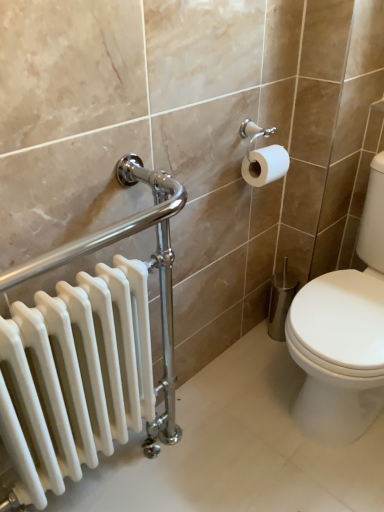
Image resolution: width=384 pixels, height=512 pixels. What are the coordinates of `free spot below white glossy radiator at left (from a real-world perspective)` in the screenshot? It's located at [134, 474].